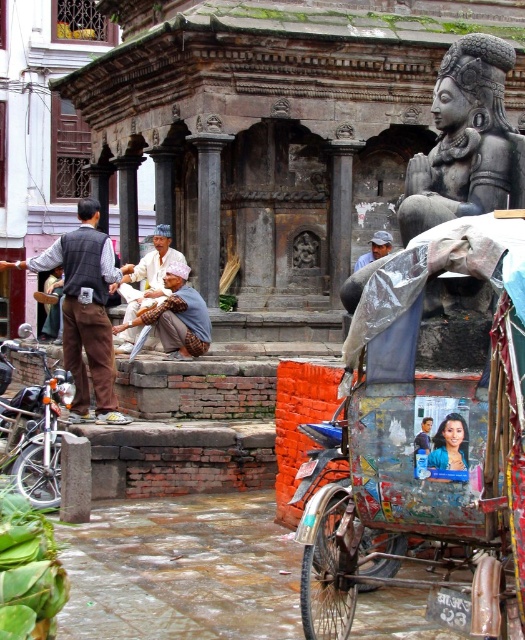
You are a tourist standing in the street scene and want to take a photo of both the black stone statue at upper right and the light brown woven fabric at center. Which object should you frame first in your camera to ensure both are visible in the same shot?

The black stone statue at upper right has a lesser width compared to light brown woven fabric at center, so you should frame the wider light brown woven fabric at center first to accommodate its size and then adjust to include the smaller statue.

You are a tourist standing in the street scene and want to take a photo of both the black stone statue at upper right and the light blue fabric at center. Which object should you frame first in your camera to ensure both are fully visible in the photo?

You should frame the black stone statue at upper right first because it is wider than the light blue fabric at center, so capturing its full width will automatically include the narrower light blue fabric at center in the photo.

You are a tourist visiting this street and want to take a photo of both the black stone statue at upper right and the light blue fabric at center. Since you have a camera with limited zoom, which object should you move closer to in order to capture both in the frame?

Since the black stone statue at upper right is larger in size than the light blue fabric at center, you should move closer to the light blue fabric at center to include both in the frame.